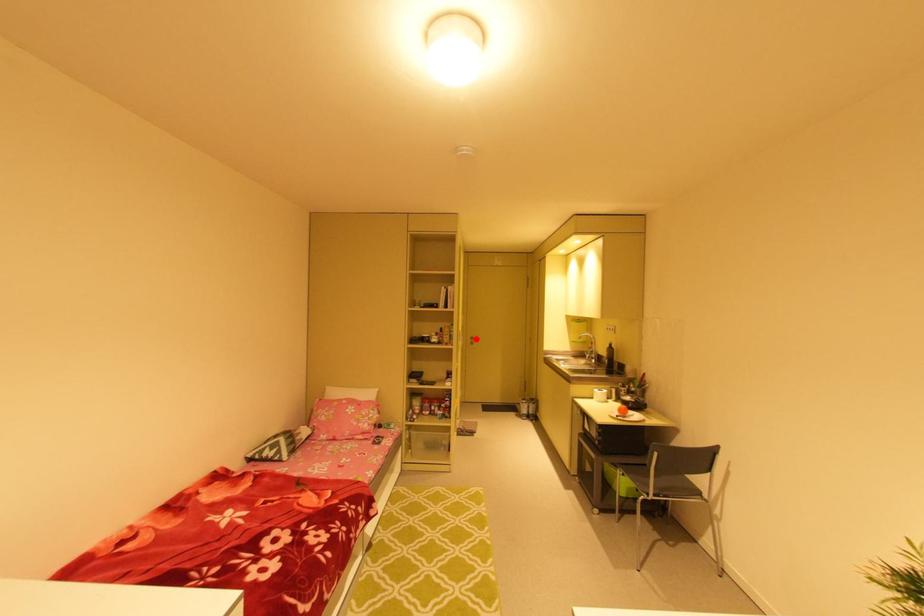
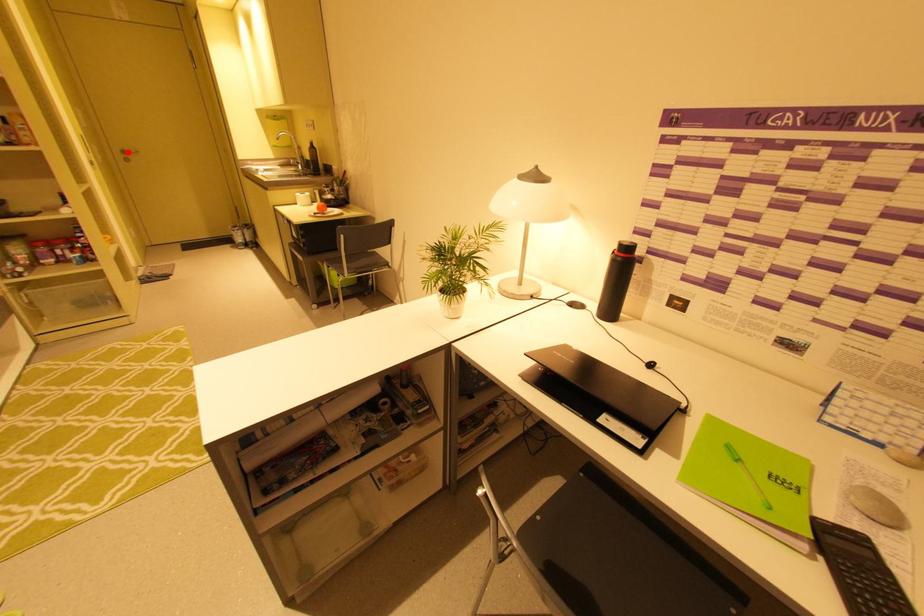
I am providing you with two images of the same scene from different viewpoints. A red point is marked on the first image and another point is marked on the second image. Does the point marked in image1 correspond to the same location as the one in image2?

Yes